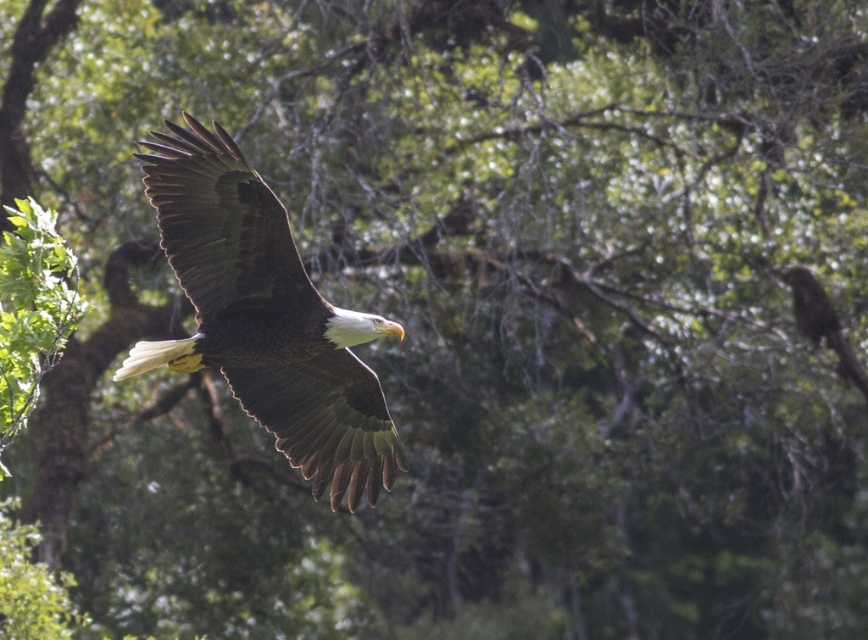
You are a wildlife photographer aiming to capture a closeup shot of the dark brown feathers at center. Given that your telephoto lens has a maximum effective range of 20 meters, will you be able to take a clear photo from your current position?

The dark brown feathers at center are 20.49 meters away from the viewer. Since the telephoto lens can only reach up to 20 meters, it is slightly beyond the lens range, making it difficult to capture a clear closeup shot.

You are a wildlife photographer aiming to capture the bald eagle in the image. You notice the dark brown feathers at center and the brown textured bird at right. Which object should you focus on if you want to photograph the subject that is positioned further to the right?

The brown textured bird at right is positioned further to the right, so you should focus on it to capture the subject that is on the right side of the scene.

You are a nature photographer observing the bald eagle in flight. You notice two elements in the scene, the dark brown feathers at center and the brown textured bird at right. Which of these elements is positioned lower in the frame?

The dark brown feathers at center is positioned lower in the frame than the brown textured bird at right.